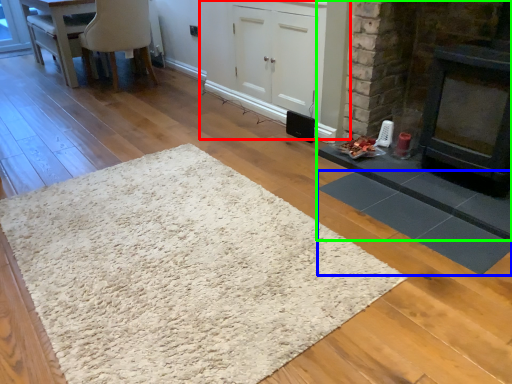
Question: Which object is the closest to the cabinetry (highlighted by a red box)? Choose among these: mat (highlighted by a blue box) or fireplace (highlighted by a green box).

Choices:
 (A) mat
 (B) fireplace

Answer: (B)